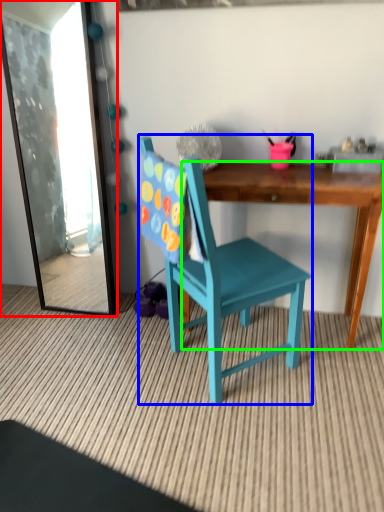
Question: Which object is positioned farthest from mirror (highlighted by a red box)? Select from chair (highlighted by a blue box) and desk (highlighted by a green box).

Choices:
 (A) chair
 (B) desk

Answer: (B)